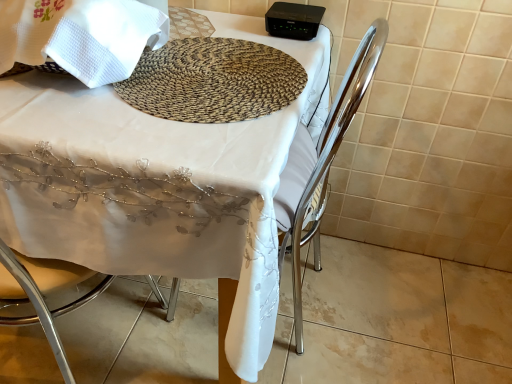
Question: Can you confirm if metallic silver chair at center is positioned to the right of white fabric table at center?

Choices:
 (A) no
 (B) yes

Answer: (B)

Question: From the image's perspective, is metallic silver chair at center located beneath white fabric table at center?

Choices:
 (A) yes
 (B) no

Answer: (B)

Question: Can you confirm if metallic silver chair at center is thinner than white fabric table at center?

Choices:
 (A) yes
 (B) no

Answer: (A)

Question: From a real-world perspective, does metallic silver chair at center stand above white fabric table at center?

Choices:
 (A) no
 (B) yes

Answer: (B)

Question: Can you confirm if metallic silver chair at center is taller than white fabric table at center?

Choices:
 (A) yes
 (B) no

Answer: (A)

Question: Considering the relative positions of metallic silver chair at center and woven natural fiber mat at center in the image provided, is metallic silver chair at center to the left or to the right of woven natural fiber mat at center?

Choices:
 (A) right
 (B) left

Answer: (A)

Question: In terms of height, does metallic silver chair at center look taller or shorter compared to woven natural fiber mat at center?

Choices:
 (A) short
 (B) tall

Answer: (B)

Question: Is metallic silver chair at center bigger or smaller than woven natural fiber mat at center?

Choices:
 (A) big
 (B) small

Answer: (A)

Question: Considering the positions of metallic silver chair at center and woven natural fiber mat at center in the image, is metallic silver chair at center wider or thinner than woven natural fiber mat at center?

Choices:
 (A) thin
 (B) wide

Answer: (B)

Question: Is white fabric table at center to the left or to the right of metallic silver chair at center in the image?

Choices:
 (A) left
 (B) right

Answer: (A)

Question: Is white fabric table at center situated inside metallic silver chair at center or outside?

Choices:
 (A) outside
 (B) inside

Answer: (A)

Question: Is point (154, 254) positioned closer to the camera than point (295, 230)?

Choices:
 (A) closer
 (B) farther

Answer: (A)

Question: Looking at their shapes, would you say white fabric table at center is wider or thinner than metallic silver chair at center?

Choices:
 (A) wide
 (B) thin

Answer: (A)

Question: Considering the positions of white fabric table at center and woven natural fiber mat at center in the image, is white fabric table at center wider or thinner than woven natural fiber mat at center?

Choices:
 (A) thin
 (B) wide

Answer: (B)

Question: From a real-world perspective, relative to woven natural fiber mat at center, is white fabric table at center vertically above or below?

Choices:
 (A) below
 (B) above

Answer: (A)